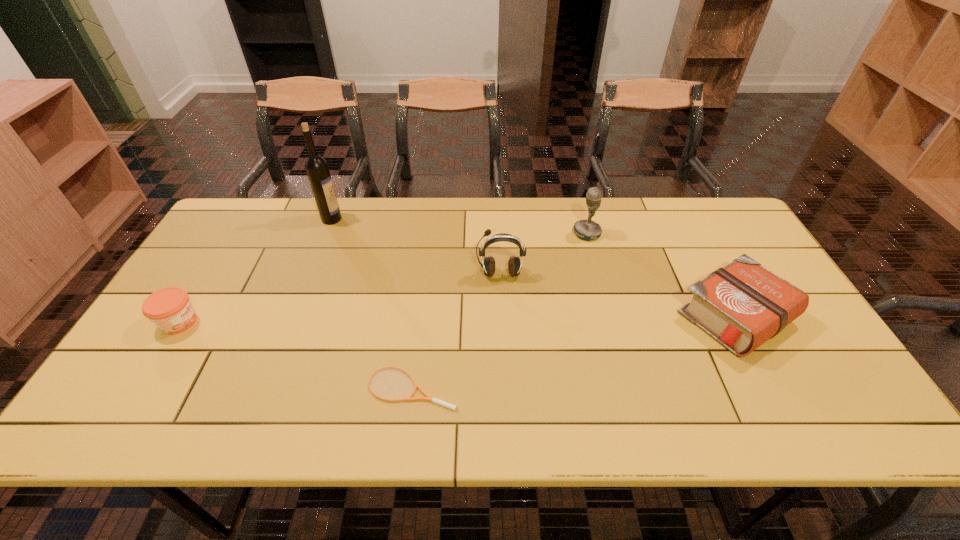
This screenshot has width=960, height=540. I want to click on free location that satisfies the following two spatial constraints: 1. on the ear pads of the fourth object from left to right; 2. on the left side of the Bible, so click(502, 317).

This screenshot has width=960, height=540. I want to click on free space that satisfies the following two spatial constraints: 1. on the ear pads of the fourth object from left to right; 2. on the front label of the second shortest object, so tap(502, 322).

You are a GUI agent. You are given a task and a screenshot of the screen. Output one action in this format:
    pyautogui.click(x=<x>, y=<y>)
    Task: Click on the free space in the image that satisfies the following two spatial constraints: 1. on the front label of the third object from left to right; 2. on the right side of the leftmost object
    Image resolution: width=960 pixels, height=540 pixels.
    Given the screenshot: What is the action you would take?
    pyautogui.click(x=139, y=387)

Where is `vacant space that satisfies the following two spatial constraints: 1. on the front-facing side of the second object from right to left; 2. on the back side of the Bible`? This screenshot has height=540, width=960. vacant space that satisfies the following two spatial constraints: 1. on the front-facing side of the second object from right to left; 2. on the back side of the Bible is located at coordinates (610, 317).